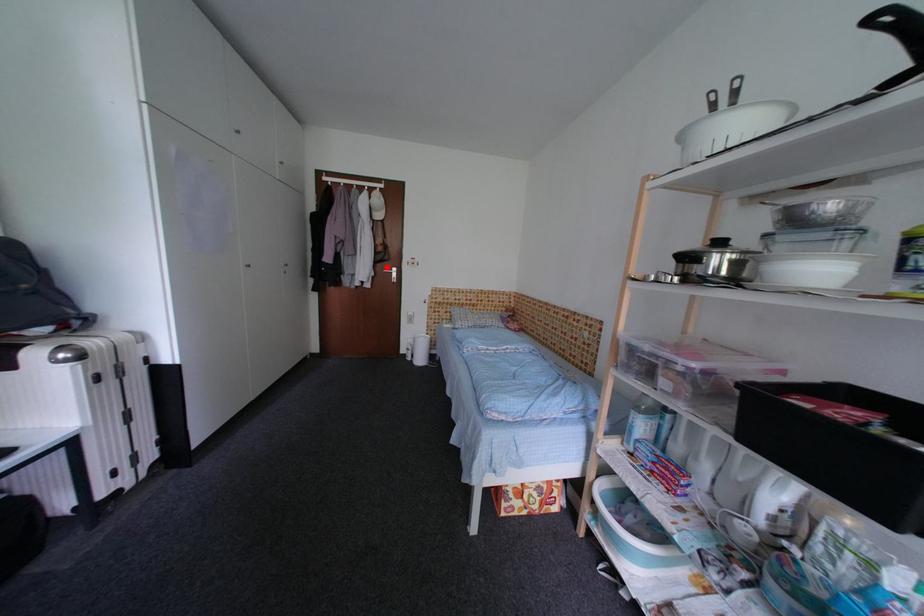
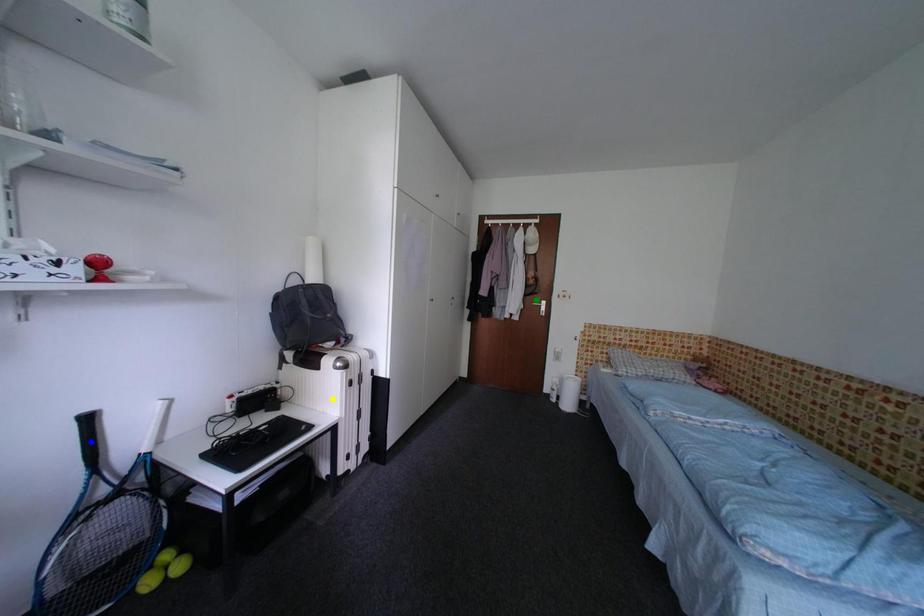
Question: I am providing you with two images of the same scene from different viewpoints. A red point is marked on the first image. You are given multiple points on the second image. Which point in image 2 is actually the same real-world point as the red point in image 1?

Choices:
 (A) yellow point
 (B) blue point
 (C) green point

Answer: (C)